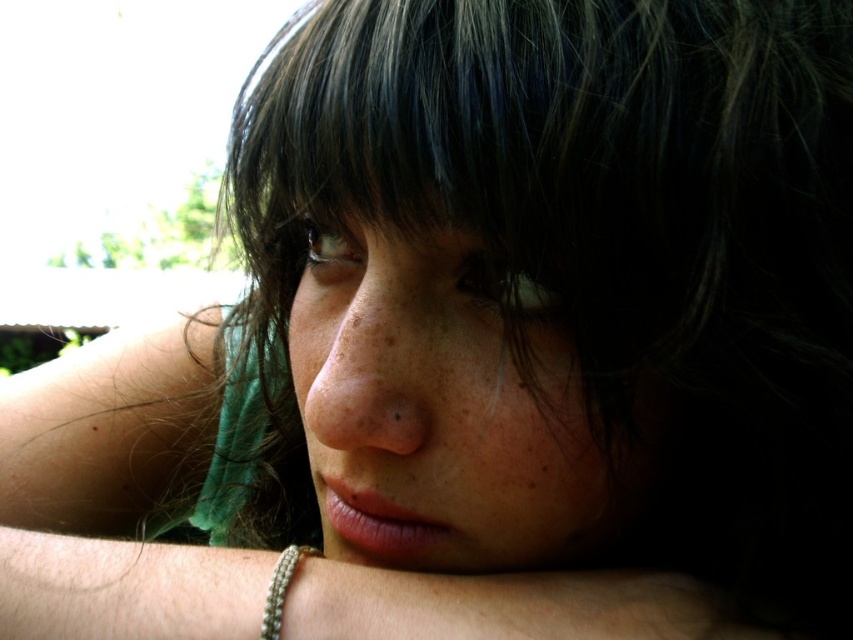
Question: Is smooth silver bracelet at lower center wider than silver metallic bracelet at lower left?

Choices:
 (A) no
 (B) yes

Answer: (B)

Question: Can you confirm if smooth silver bracelet at lower center is wider than silver metallic bracelet at lower left?

Choices:
 (A) no
 (B) yes

Answer: (B)

Question: Among these points, which one is nearest to the camera?

Choices:
 (A) (720, 612)
 (B) (271, 618)
 (C) (300, 317)

Answer: (B)

Question: Among these points, which one is nearest to the camera?

Choices:
 (A) (669, 636)
 (B) (419, 195)
 (C) (276, 630)

Answer: (B)

Question: Can you confirm if smooth skin face at center is positioned above silver metallic bracelet at lower left?

Choices:
 (A) no
 (B) yes

Answer: (B)

Question: Which object is closer to the camera taking this photo?

Choices:
 (A) silver metallic bracelet at lower left
 (B) smooth skin face at center
 (C) smooth silver bracelet at lower center

Answer: (B)